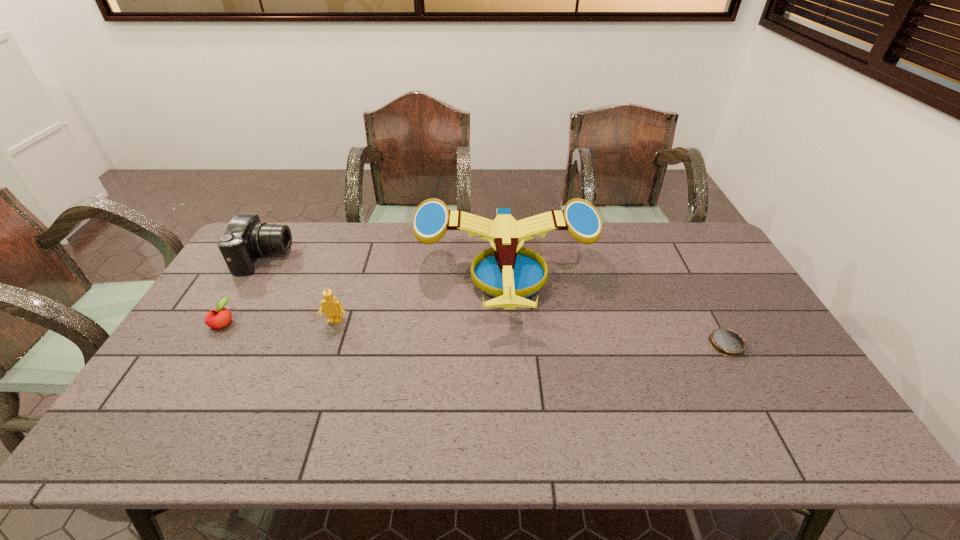
Where is `the tallest object`? Image resolution: width=960 pixels, height=540 pixels. the tallest object is located at coordinates (510, 273).

Identify the location of the fourth object from left to right. (510, 273).

This screenshot has width=960, height=540. What are the coordinates of `camera` in the screenshot? It's located at (246, 238).

Identify the location of the third tallest object. This screenshot has width=960, height=540. pos(333,309).

I want to click on Lego, so click(333, 309).

Where is `the fourth tallest object`? This screenshot has height=540, width=960. the fourth tallest object is located at coordinates (220, 317).

Find the location of a particular element. This screenshot has width=960, height=540. compass is located at coordinates (726, 342).

Where is `the shortest object`? This screenshot has width=960, height=540. the shortest object is located at coordinates coord(726,342).

Locate an element on the screen. free space located 0.070m at the cockpit of the tallest object is located at coordinates click(512, 351).

The height and width of the screenshot is (540, 960). I want to click on vacant area located on the lens of the camera, so click(x=347, y=258).